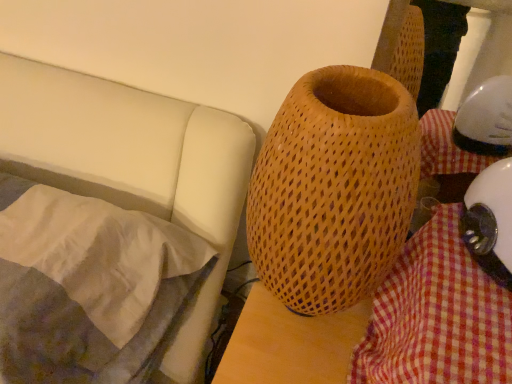
Question: From a real-world perspective, is wooden textured vase at center physically below white glossy helmet at lower right?

Choices:
 (A) no
 (B) yes

Answer: (B)

Question: Can you confirm if wooden textured vase at center is bigger than white glossy helmet at lower right?

Choices:
 (A) yes
 (B) no

Answer: (A)

Question: Does wooden textured vase at center turn towards white glossy helmet at lower right?

Choices:
 (A) no
 (B) yes

Answer: (A)

Question: Can you confirm if wooden textured vase at center is positioned to the left of white glossy helmet at lower right?

Choices:
 (A) no
 (B) yes

Answer: (B)

Question: Is wooden textured vase at center shorter than white glossy helmet at lower right?

Choices:
 (A) yes
 (B) no

Answer: (B)

Question: From a real-world perspective, is wooden textured vase at center positioned over white glossy helmet at lower right based on gravity?

Choices:
 (A) no
 (B) yes

Answer: (A)

Question: Can you confirm if checkered fabric at lower right is bigger than wooden textured vase at center?

Choices:
 (A) no
 (B) yes

Answer: (A)

Question: From the image's perspective, is checkered fabric at lower right over wooden textured vase at center?

Choices:
 (A) yes
 (B) no

Answer: (B)

Question: Is checkered fabric at lower right at the left side of wooden textured vase at center?

Choices:
 (A) no
 (B) yes

Answer: (A)

Question: Is checkered fabric at lower right positioned beyond the bounds of wooden textured vase at center?

Choices:
 (A) yes
 (B) no

Answer: (A)

Question: Is checkered fabric at lower right oriented away from wooden textured vase at center?

Choices:
 (A) no
 (B) yes

Answer: (A)

Question: Is checkered fabric at lower right wider than wooden textured vase at center?

Choices:
 (A) yes
 (B) no

Answer: (A)

Question: Is the surface of silky white pillow at left in direct contact with checkered fabric at lower right?

Choices:
 (A) no
 (B) yes

Answer: (A)